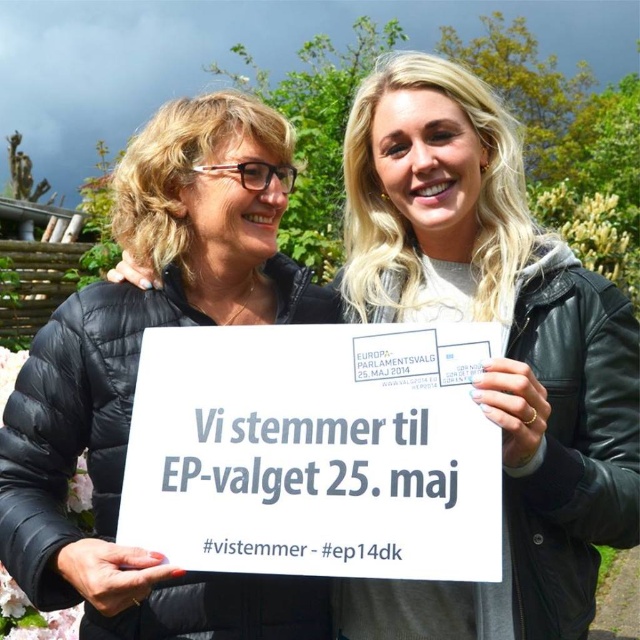
You are a photographer trying to capture a clear photo of the white matte sign at center and the black quilted jacket at left. Based on their sizes, which object should you focus on first to ensure it appears larger in the photo?

The white matte sign at center is much taller than the black quilted jacket at left, so you should focus on the white matte sign at center first to ensure it appears larger in the photo.

From the picture: You are a photographer trying to capture both the white matte sign at center and the white paper sign at center in a single frame. Which sign should you adjust your camera angle to focus on first if you want to ensure both are fully visible?

The white matte sign at center has a lesser width compared to the white paper sign at center, so you should focus on the wider white paper sign at center first to ensure it fits properly, then adjust to include the narrower white matte sign at center.